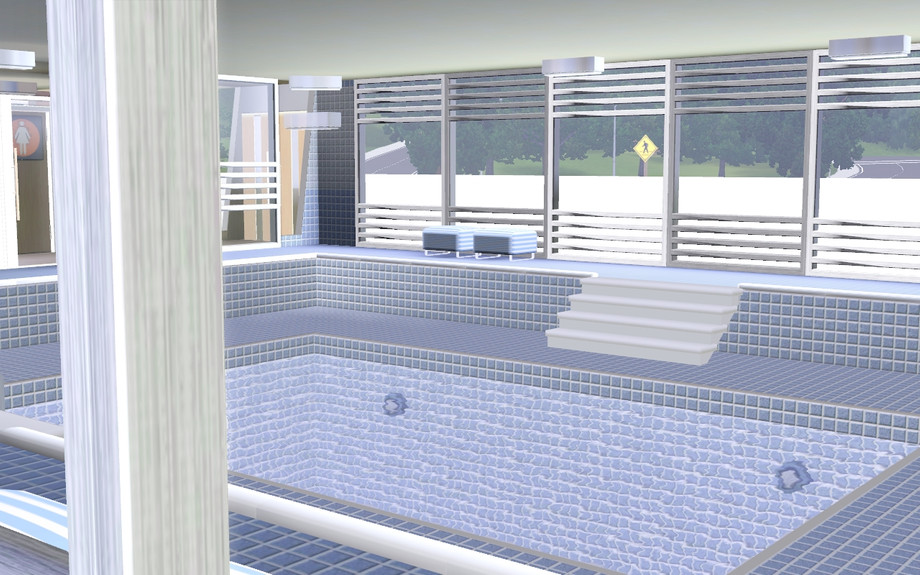
The height and width of the screenshot is (575, 920). In order to click on column in this screenshot , I will do `click(159, 529)`.